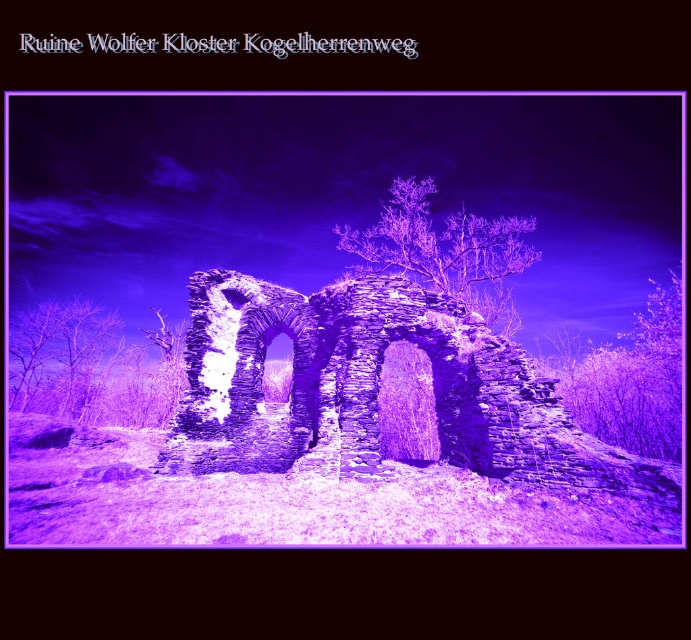
Question: Which object is the farthest from the purple textured tree at right?

Choices:
 (A) stone arches at center
 (B) purple stone tree at center

Answer: (A)

Question: Which of the following is the farthest from the observer?

Choices:
 (A) (489, 275)
 (B) (645, 410)

Answer: (A)

Question: Among these objects, which one is nearest to the camera?

Choices:
 (A) stone arches at center
 (B) purple stone tree at center

Answer: (A)

Question: Does stone arches at center appear on the right side of purple textured tree at right?

Choices:
 (A) yes
 (B) no

Answer: (B)

Question: Is stone arches at center below purple stone tree at center?

Choices:
 (A) no
 (B) yes

Answer: (B)

Question: Is purple textured tree at right above purple stone tree at center?

Choices:
 (A) no
 (B) yes

Answer: (A)